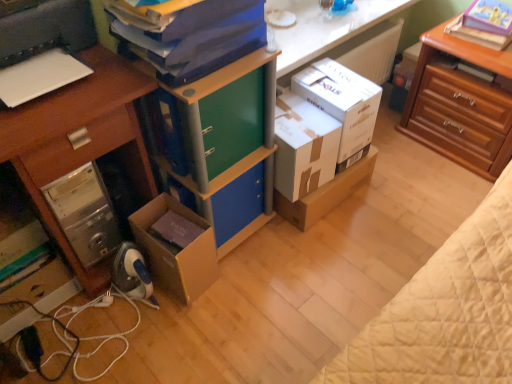
You are a GUI agent. You are given a task and a screenshot of the screen. Output one action in this format:
    pyautogui.click(x=<x>, y=<y>)
    Task: Click on the vacant space situated above white cardboard box at center, placed as the second box when sorted from right to left (from a real-world perspective)
    
    Given the screenshot: What is the action you would take?
    pyautogui.click(x=297, y=117)